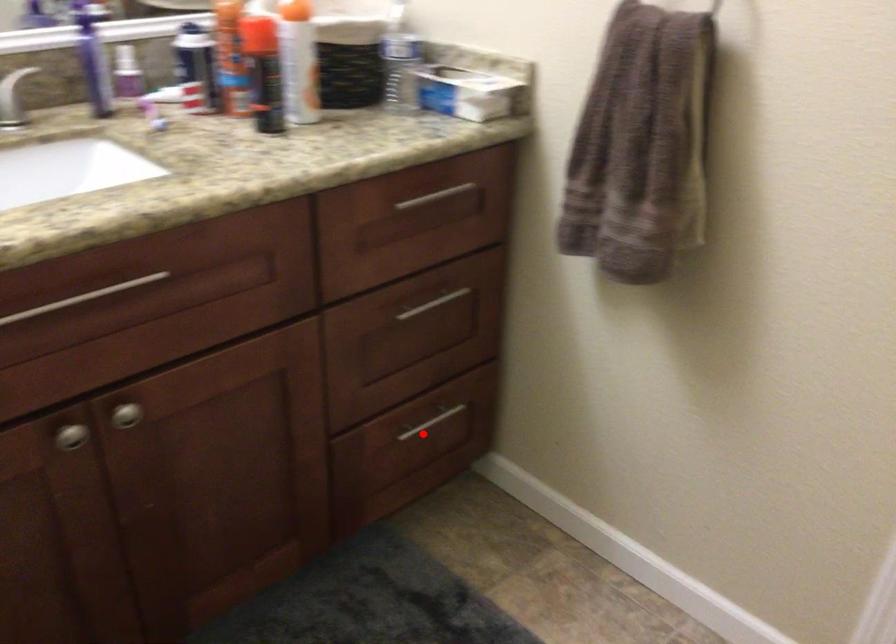
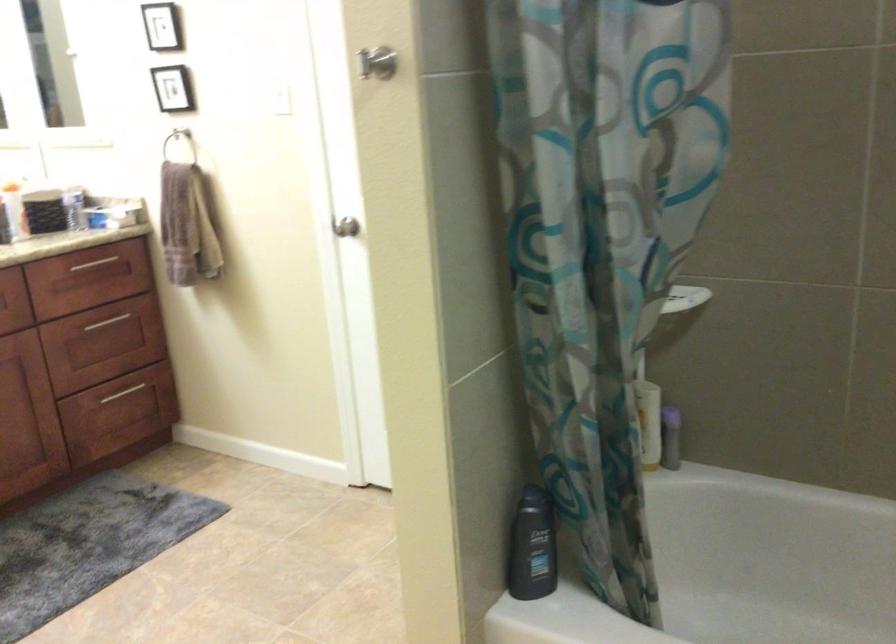
Question: I am providing you with two images of the same scene from different viewpoints. Image1 has a red point marked. In image2, the corresponding 3D location appears at what relative position? Reply with the corresponding letter.

Choices:
 (A) Closer
 (B) Farther

Answer: (B)